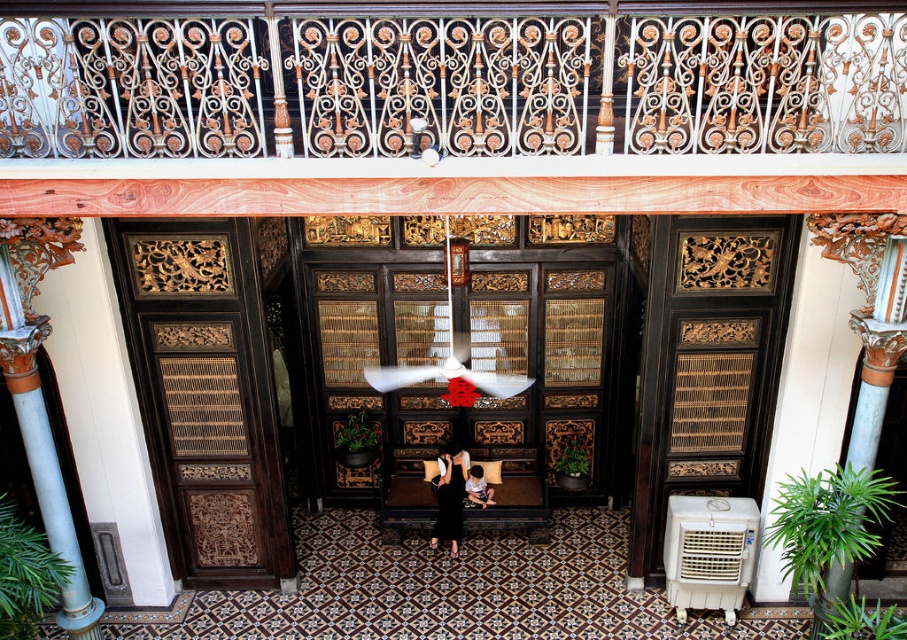
You are a guest at a formal event and are standing in the room described. You notice the white wrought iron railing at upper center and the black matte dress at center. Which object is taller?

The black matte dress at center is taller than the white wrought iron railing at upper center.

You are standing in the room and see two points marked in the scene. From your perspective, which point is closer to you? The points are located at coordinates point (95, 83) and point (440, 486).

Point (95, 83) is in front of point (440, 486), so it is closer to you.

You are standing in the room and want to touch both the white wrought iron railing at upper center and the dark brown leather chair at center. Which object should you reach for first if you want to touch the closer one first?

The white wrought iron railing at upper center is closer to the viewer than the dark brown leather chair at center, so you should reach for the white wrought iron railing at upper center first.